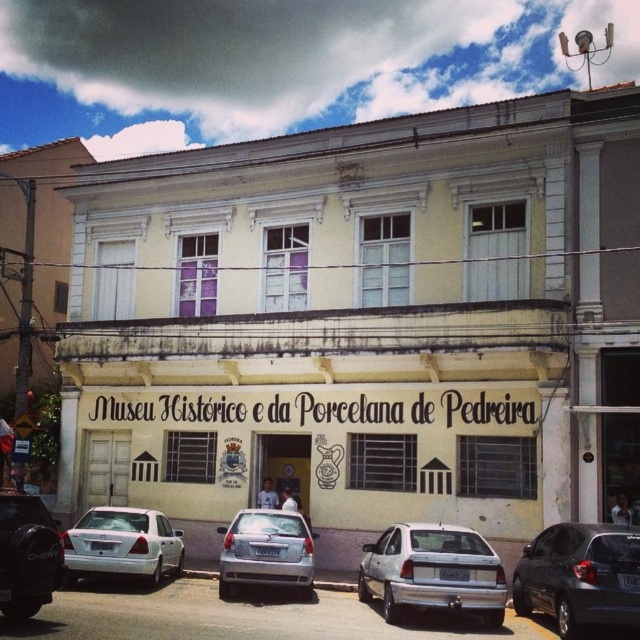
Question: Which is nearer to the white matte sedan at lower left?

Choices:
 (A) satin silver sedan at center
 (B) matte black car at lower left
 (C) white matte sedan at center
 (D) shiny black sedan at lower right

Answer: (A)

Question: Which is farther from the matte black car at lower left?

Choices:
 (A) satin silver sedan at center
 (B) white matte sedan at center
 (C) white matte sedan at lower left
 (D) shiny black sedan at lower right

Answer: (D)

Question: Can you confirm if satin silver sedan at center is wider than matte black car at lower left?

Choices:
 (A) no
 (B) yes

Answer: (B)

Question: Which point is farther to the camera?

Choices:
 (A) (172, 547)
 (B) (10, 547)
 (C) (138, 456)
 (D) (448, 560)

Answer: (C)

Question: Does yellow matte building at center appear under shiny black sedan at lower right?

Choices:
 (A) yes
 (B) no

Answer: (B)

Question: Where is yellow matte building at center located in relation to matte black car at lower left in the image?

Choices:
 (A) right
 (B) left

Answer: (A)